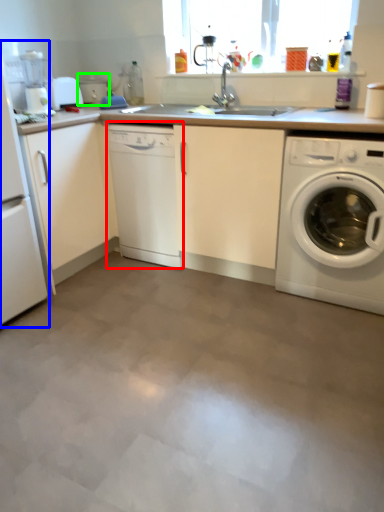
Question: Considering the real-world distances, which object is farthest from dish washer (highlighted by a red box)? home appliance (highlighted by a blue box) or appliance (highlighted by a green box)?

Choices:
 (A) home appliance
 (B) appliance

Answer: (B)